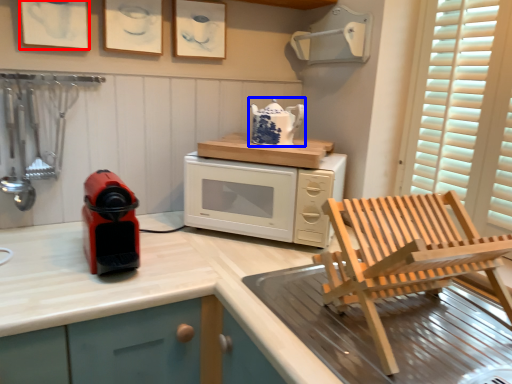
Question: Which object appears farthest to the camera in this image, picture frame (highlighted by a red box) or kitchen appliance (highlighted by a blue box)?

Choices:
 (A) picture frame
 (B) kitchen appliance

Answer: (B)